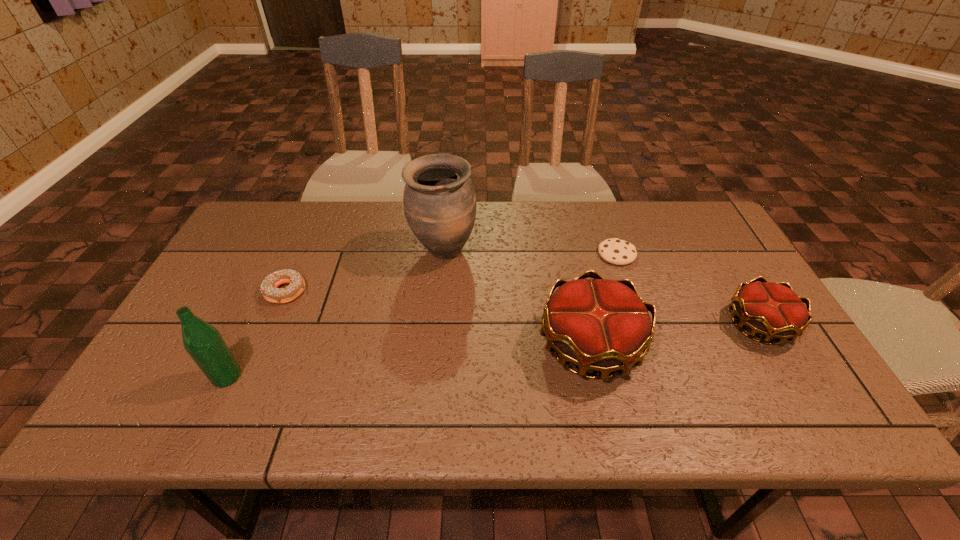
This screenshot has width=960, height=540. What are the coordinates of `vacant space that's between the doughnut and the cookie` in the screenshot? It's located at (451, 273).

In order to click on free space between the doughnut and the urn in this screenshot , I will do `click(365, 271)`.

At what (x,y) coordinates should I click in order to perform the action: click on vacant area that lies between the bottle and the taller crown. Please return your answer as a coordinate pair (x, y). The height and width of the screenshot is (540, 960). Looking at the image, I should click on (409, 360).

This screenshot has width=960, height=540. I want to click on free spot between the urn and the second tallest object, so click(335, 314).

Find the location of a particular element. The height and width of the screenshot is (540, 960). unoccupied position between the cookie and the shorter crown is located at coordinates (688, 289).

Find the location of a particular element. blank region between the cookie and the urn is located at coordinates (530, 253).

Locate an element on the screen. empty location between the cookie and the second tallest object is located at coordinates (421, 315).

Identify which object is the fifth nearest to the fourth shortest object. Please provide its 2D coordinates. Your answer should be formatted as a tuple, i.e. [(x, y)], where the tuple contains the x and y coordinates of a point satisfying the conditions above.

[(203, 342)]

Where is `object that is the closest one to the doughnut`? object that is the closest one to the doughnut is located at coordinates (203, 342).

Identify the location of vacant region that satisfies the following two spatial constraints: 1. on the back side of the shorter crown; 2. on the left side of the bottle. This screenshot has height=540, width=960. (252, 324).